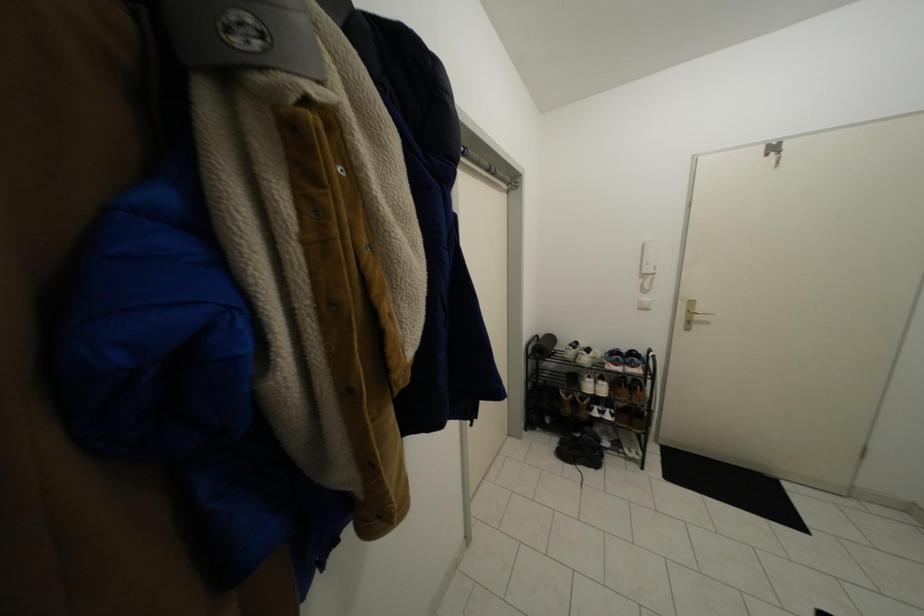
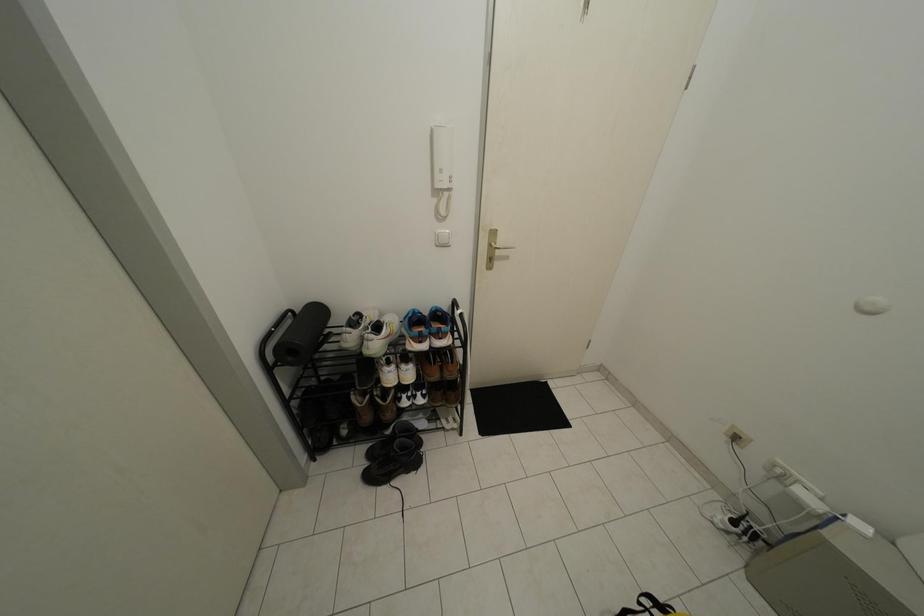
First-person continuous shooting, in which direction is the camera rotating?

The rotation direction of the camera is right-down.